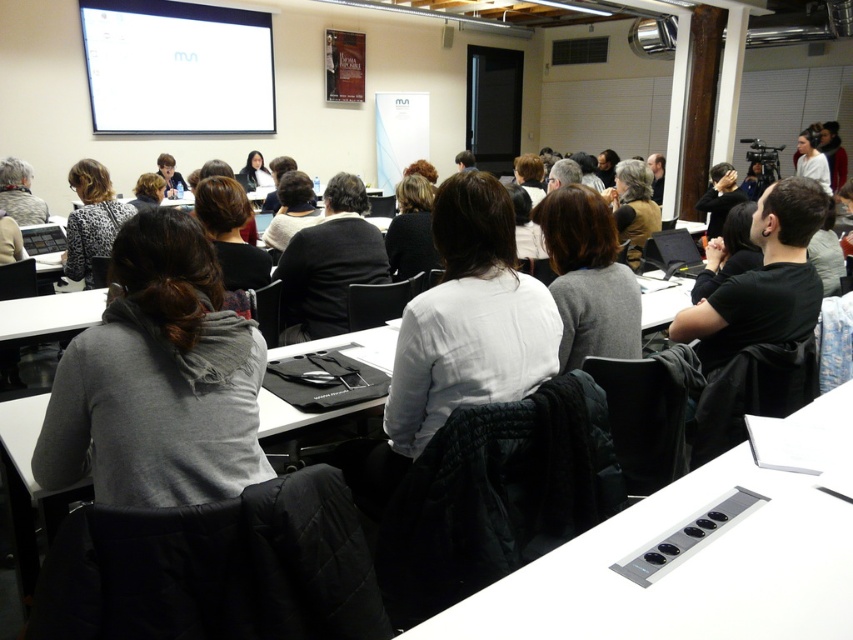
Is gray matte sweater at center shorter than dark gray suit at center?

Indeed, gray matte sweater at center has a lesser height compared to dark gray suit at center.

Between point (560, 188) and point (341, 250), which one is positioned behind?

The point (341, 250) is more distant.

Does point (587, 353) lie in front of point (287, 284)?

Yes, it is in front of point (287, 284).

Locate an element on the screen. Image resolution: width=853 pixels, height=640 pixels. gray matte sweater at center is located at coordinates (589, 276).

Can you confirm if black matte shirt at center is taller than printed fabric jacket at left?

No, black matte shirt at center is not taller than printed fabric jacket at left.

Is point (792, 323) positioned behind point (88, 236)?

No, (792, 323) is closer to viewer.

Between point (805, 196) and point (102, 234), which one is positioned in front?

Point (805, 196) is in front.

The image size is (853, 640). Identify the location of black matte shirt at center. (763, 282).

Between dark gray suit at center and printed fabric jacket at left, which one is positioned higher?

Positioned higher is printed fabric jacket at left.

Does dark gray suit at center appear on the right side of printed fabric jacket at left?

Yes, dark gray suit at center is to the right of printed fabric jacket at left.

Which is in front, point (331, 324) or point (94, 216)?

Point (331, 324)

In order to click on dark gray suit at center in this screenshot , I will do `click(329, 262)`.